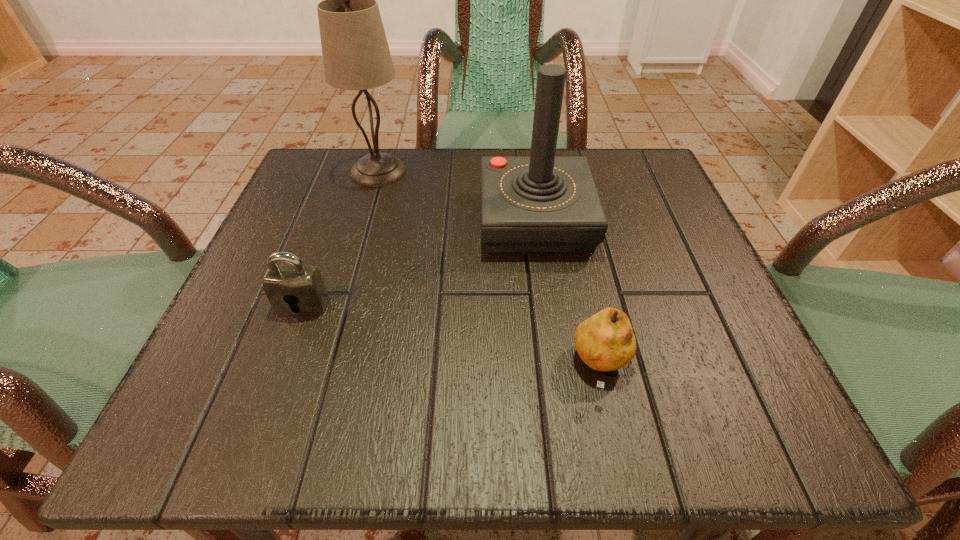
Where is `vacant space at the far left corner of the desktop`? vacant space at the far left corner of the desktop is located at coordinates (363, 148).

The image size is (960, 540). Find the location of `blank space at the near left corner of the desktop`. blank space at the near left corner of the desktop is located at coordinates (235, 406).

In the image, there is a desktop. In order to click on vacant region at the far right corner in this screenshot , I will do `click(658, 207)`.

Identify the location of vacant space at the near right corner of the desktop. This screenshot has height=540, width=960. (762, 450).

Locate an element on the screen. empty space that is in between the pear and the tallest object is located at coordinates (491, 269).

Where is `blank region between the third farthest object and the second farthest object`? The image size is (960, 540). blank region between the third farthest object and the second farthest object is located at coordinates (420, 263).

The image size is (960, 540). I want to click on unoccupied area between the joystick and the pear, so click(568, 294).

This screenshot has height=540, width=960. What are the coordinates of `vacant point located between the lampshade and the joystick` in the screenshot? It's located at (457, 196).

You are a GUI agent. You are given a task and a screenshot of the screen. Output one action in this format:
    pyautogui.click(x=<x>, y=<y>)
    Task: Click on the vacant area that lies between the lampshade and the nearest object
    This screenshot has width=960, height=540.
    Given the screenshot: What is the action you would take?
    491,269

Where is `vacant space in between the pear and the second farthest object`? The width and height of the screenshot is (960, 540). vacant space in between the pear and the second farthest object is located at coordinates (568, 294).